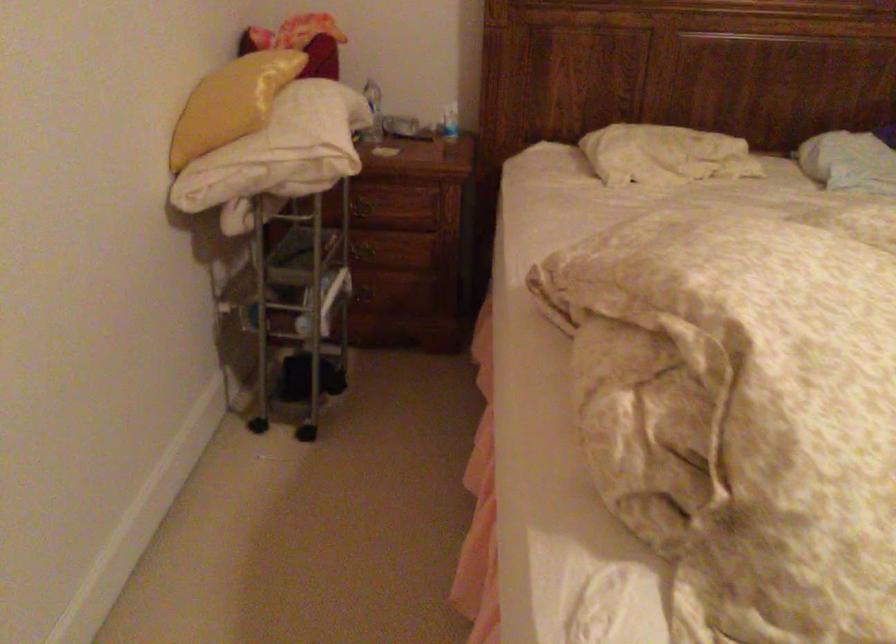
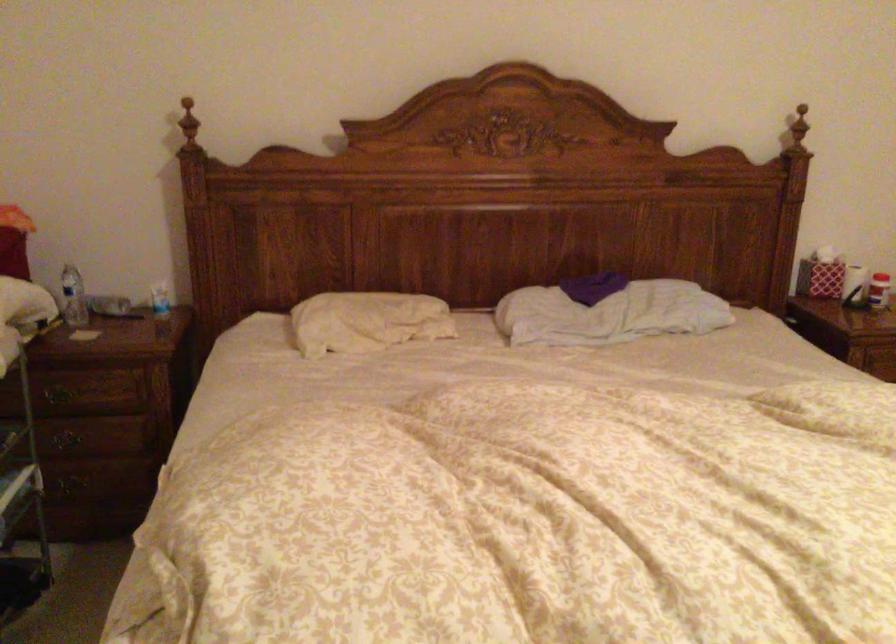
Question: The camera is either moving clockwise (left) or counter-clockwise (right) around the object. The first image is from the beginning of the video and the second image is from the end. Is the camera moving left or right when shooting the video?

Choices:
 (A) Left
 (B) Right

Answer: (A)